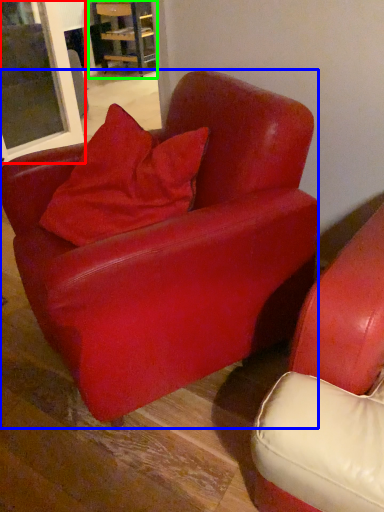
Question: Which object is the closest to the window (highlighted by a red box)? Choose among these: chair (highlighted by a blue box) or table (highlighted by a green box).

Choices:
 (A) chair
 (B) table

Answer: (A)